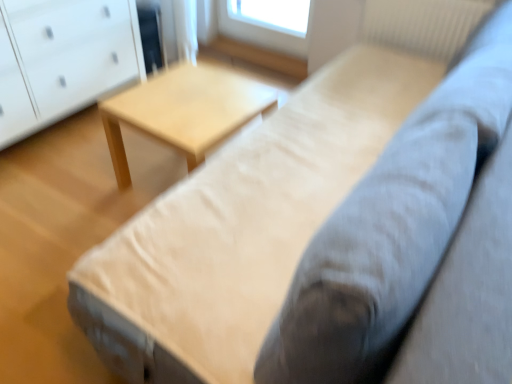
Question: Should I look upward or downward to see white textured radiator at upper right?

Choices:
 (A) up
 (B) down

Answer: (A)

Question: Is light wood table at center positioned before white textured radiator at upper right?

Choices:
 (A) no
 (B) yes

Answer: (B)

Question: Is light wood table at center oriented away from white textured radiator at upper right?

Choices:
 (A) yes
 (B) no

Answer: (B)

Question: Is the position of light wood table at center more distant than that of white textured radiator at upper right?

Choices:
 (A) no
 (B) yes

Answer: (A)

Question: Can you confirm if light wood table at center is taller than white textured radiator at upper right?

Choices:
 (A) no
 (B) yes

Answer: (A)

Question: Is light wood table at center located outside white textured radiator at upper right?

Choices:
 (A) no
 (B) yes

Answer: (B)

Question: Is light wood table at center facing towards white textured radiator at upper right?

Choices:
 (A) yes
 (B) no

Answer: (B)

Question: Can you confirm if white glossy chest of drawers at left is shorter than light wood table at center?

Choices:
 (A) no
 (B) yes

Answer: (A)

Question: Is white glossy chest of drawers at left taller than light wood table at center?

Choices:
 (A) no
 (B) yes

Answer: (B)

Question: Can you confirm if white glossy chest of drawers at left is bigger than light wood table at center?

Choices:
 (A) no
 (B) yes

Answer: (B)

Question: Is white glossy chest of drawers at left touching light wood table at center?

Choices:
 (A) no
 (B) yes

Answer: (A)

Question: Is white glossy chest of drawers at left turned away from light wood table at center?

Choices:
 (A) yes
 (B) no

Answer: (B)

Question: Does white glossy chest of drawers at left appear on the right side of light wood table at center?

Choices:
 (A) yes
 (B) no

Answer: (B)

Question: Can you confirm if light wood table at center is bigger than white glossy chest of drawers at left?

Choices:
 (A) no
 (B) yes

Answer: (A)